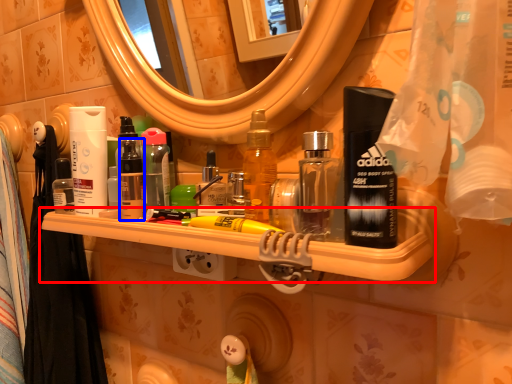
Question: Which object is closer to the camera taking this photo, shelf (highlighted by a red box) or toiletry (highlighted by a blue box)?

Choices:
 (A) shelf
 (B) toiletry

Answer: (A)